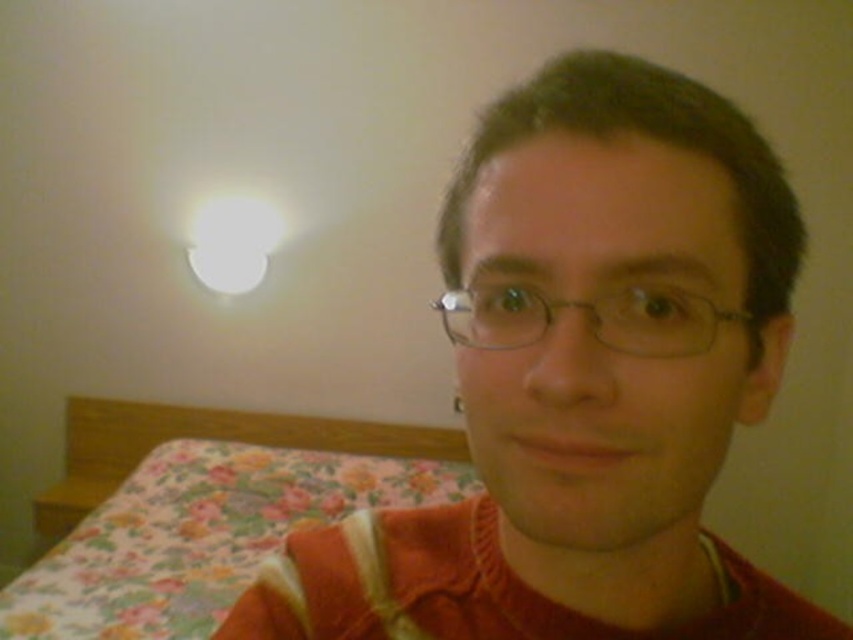
Question: Is orange fabric at center further to camera compared to floral fabric bed at lower left?

Choices:
 (A) no
 (B) yes

Answer: (A)

Question: Among these points, which one is nearest to the camera?

Choices:
 (A) (515, 400)
 (B) (178, 596)

Answer: (A)

Question: Is orange fabric at center to the left of metallic wireframe glasses at center from the viewer's perspective?

Choices:
 (A) no
 (B) yes

Answer: (A)

Question: Can you confirm if orange fabric at center is bigger than metallic wireframe glasses at center?

Choices:
 (A) yes
 (B) no

Answer: (A)

Question: Which point is closer to the camera?

Choices:
 (A) (527, 289)
 (B) (190, 480)
 (C) (593, 490)

Answer: (C)

Question: Which point is farther from the camera taking this photo?

Choices:
 (A) (764, 176)
 (B) (202, 428)
 (C) (605, 301)

Answer: (B)